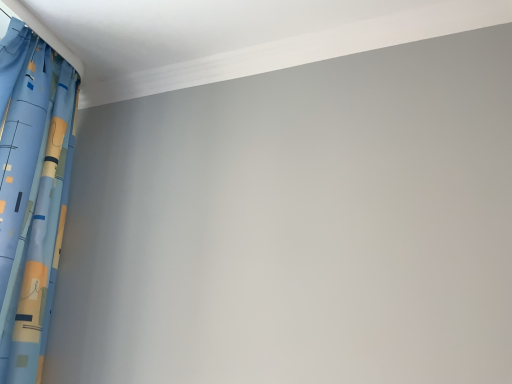
Where is `blue fabric curtain at left`? This screenshot has height=384, width=512. blue fabric curtain at left is located at coordinates (31, 193).

What do you see at coordinates (31, 193) in the screenshot? I see `blue fabric curtain at left` at bounding box center [31, 193].

This screenshot has width=512, height=384. In order to click on blue fabric curtain at left in this screenshot , I will do `click(31, 193)`.